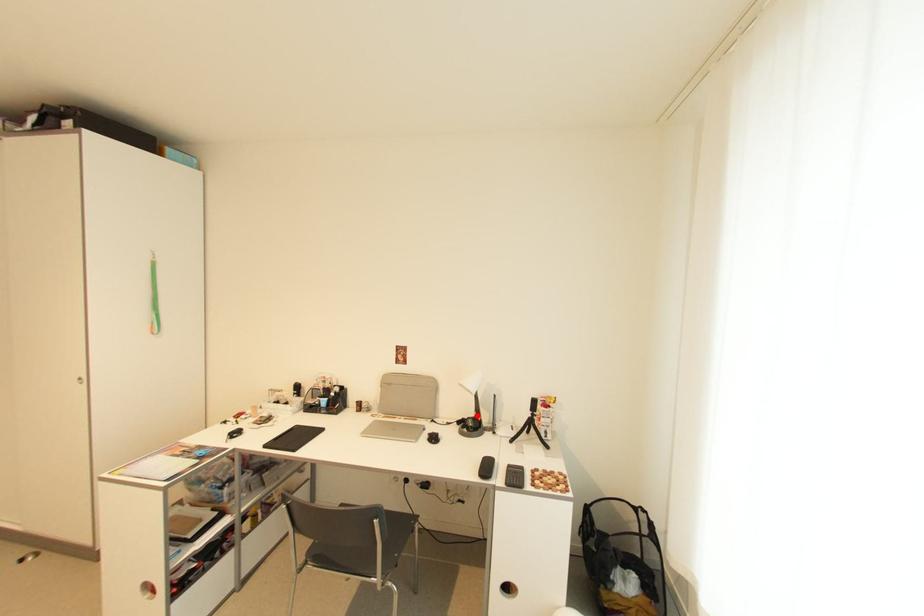
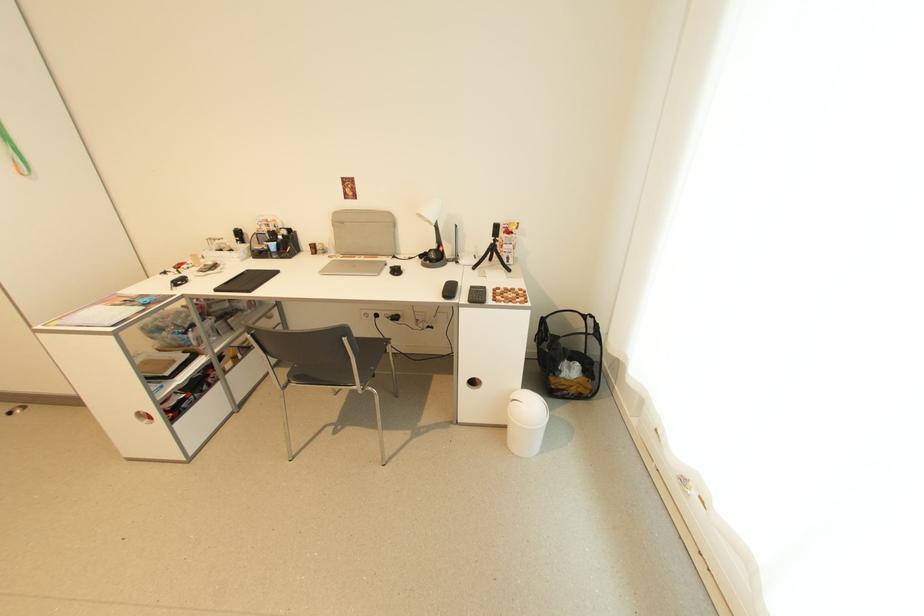
In the second image, find the point that corresponds to the highlighted location in the first image.

(439, 248)